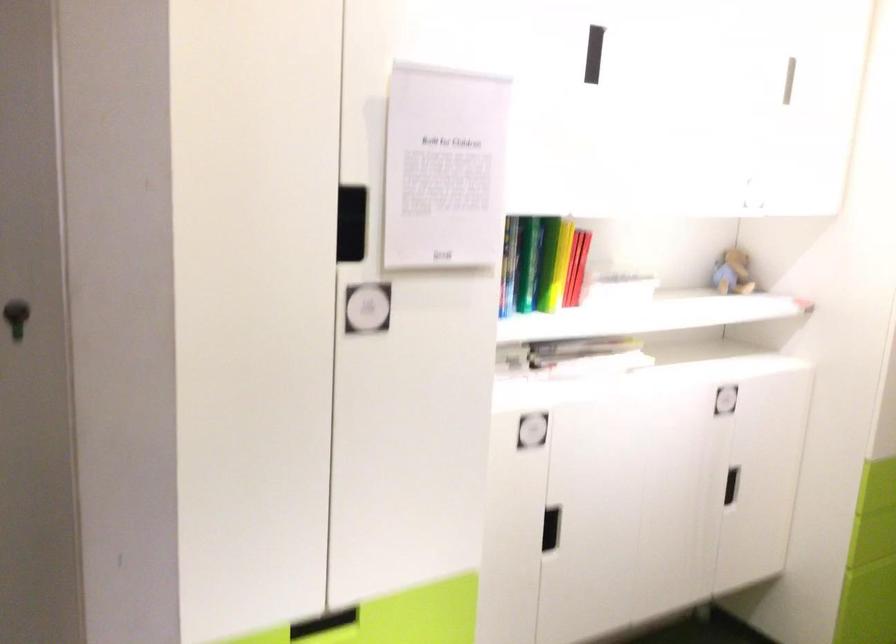
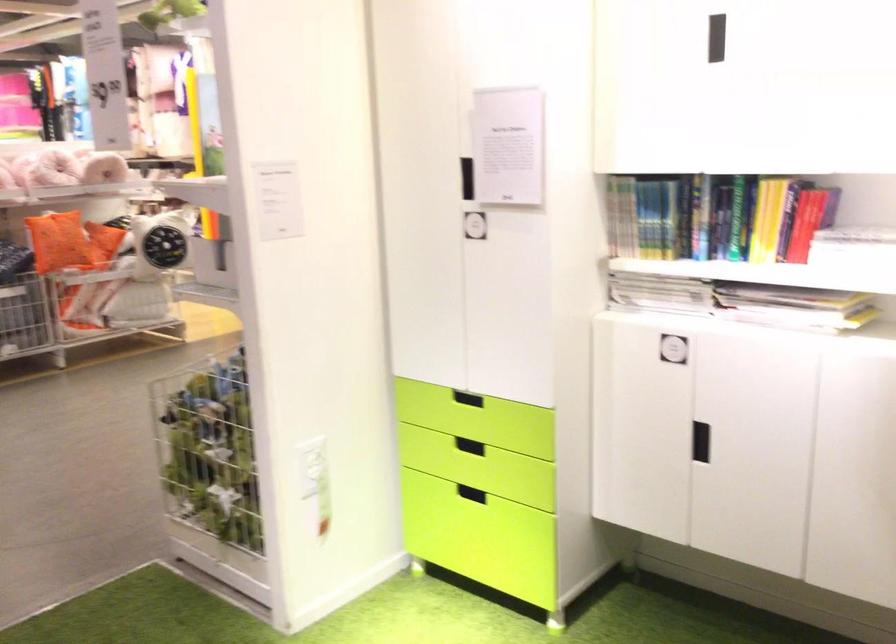
Find the pixel in the second image that matches pixel 623 289 in the first image.

(853, 245)